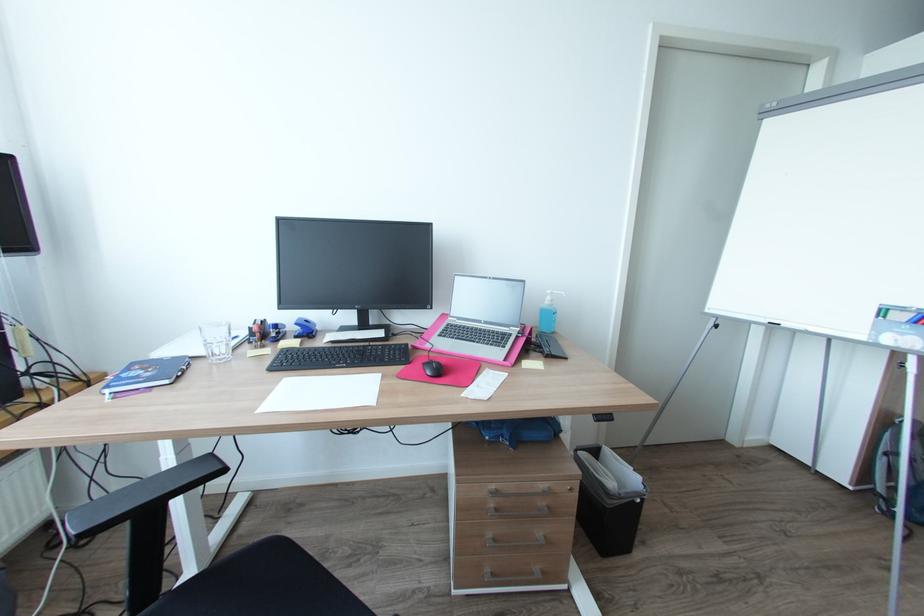
Where would you writ the blue whiteboard marker? Please return your answer as a coordinate pair (x, y).

(514, 570)